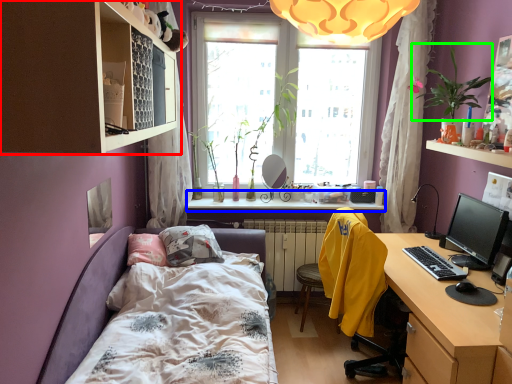
Question: Which object is the farthest from shelf (highlighted by a red box)? Choose among these: window sill (highlighted by a blue box) or plant (highlighted by a green box).

Choices:
 (A) window sill
 (B) plant

Answer: (A)